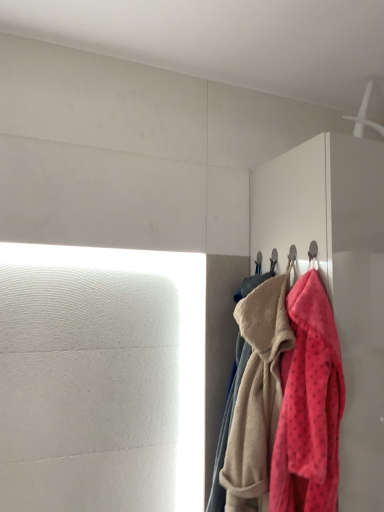
Question: From the image's perspective, is fluffy pink towel at right, marked as the first towel in a back-to-front arrangement, over fluffy pink towel at right, acting as the 1th towel starting from the front?

Choices:
 (A) yes
 (B) no

Answer: (B)

Question: Would you consider fluffy pink towel at right, marked as the first towel in a back-to-front arrangement, to be distant from fluffy pink towel at right, placed as the 2th towel when sorted from back to front?

Choices:
 (A) yes
 (B) no

Answer: (B)

Question: Does fluffy pink towel at right, placed as the second towel when sorted from front to back, appear on the left side of fluffy pink towel at right, acting as the 1th towel starting from the front?

Choices:
 (A) no
 (B) yes

Answer: (B)

Question: Is fluffy pink towel at right, marked as the first towel in a back-to-front arrangement, to the right of fluffy pink towel at right, acting as the 1th towel starting from the front, from the viewer's perspective?

Choices:
 (A) no
 (B) yes

Answer: (A)

Question: Considering the relative sizes of fluffy pink towel at right, placed as the second towel when sorted from front to back, and fluffy pink towel at right, placed as the 2th towel when sorted from back to front, in the image provided, is fluffy pink towel at right, placed as the second towel when sorted from front to back, shorter than fluffy pink towel at right, placed as the 2th towel when sorted from back to front,?

Choices:
 (A) no
 (B) yes

Answer: (A)

Question: From a real-world perspective, is fluffy pink towel at right, placed as the second towel when sorted from front to back, physically above fluffy pink towel at right, acting as the 1th towel starting from the front?

Choices:
 (A) yes
 (B) no

Answer: (B)

Question: Does matte white dresser at right have a smaller size compared to fluffy pink towel at right, acting as the 1th towel starting from the front?

Choices:
 (A) no
 (B) yes

Answer: (A)

Question: Does matte white dresser at right lie behind fluffy pink towel at right, acting as the 1th towel starting from the front?

Choices:
 (A) no
 (B) yes

Answer: (B)

Question: Could you tell me if matte white dresser at right is facing fluffy pink towel at right, acting as the 1th towel starting from the front?

Choices:
 (A) yes
 (B) no

Answer: (B)

Question: From a real-world perspective, is matte white dresser at right over fluffy pink towel at right, acting as the 1th towel starting from the front?

Choices:
 (A) yes
 (B) no

Answer: (A)

Question: From the image's perspective, is matte white dresser at right on fluffy pink towel at right, placed as the 2th towel when sorted from back to front?

Choices:
 (A) yes
 (B) no

Answer: (A)

Question: Is fluffy pink towel at right, placed as the 2th towel when sorted from back to front, at the back of matte white dresser at right?

Choices:
 (A) no
 (B) yes

Answer: (A)

Question: Is fluffy pink towel at right, acting as the 1th towel starting from the front, facing towards matte white dresser at right?

Choices:
 (A) yes
 (B) no

Answer: (B)